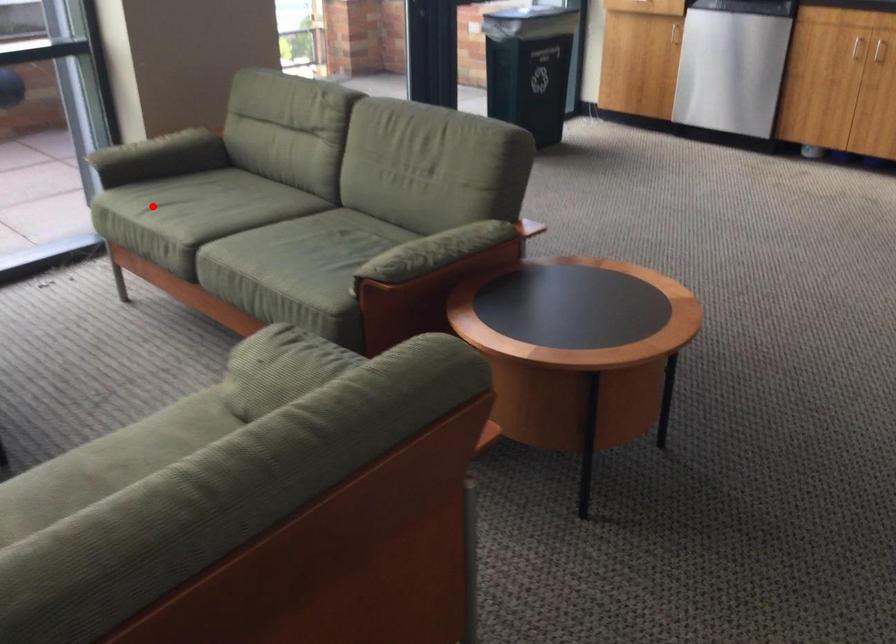
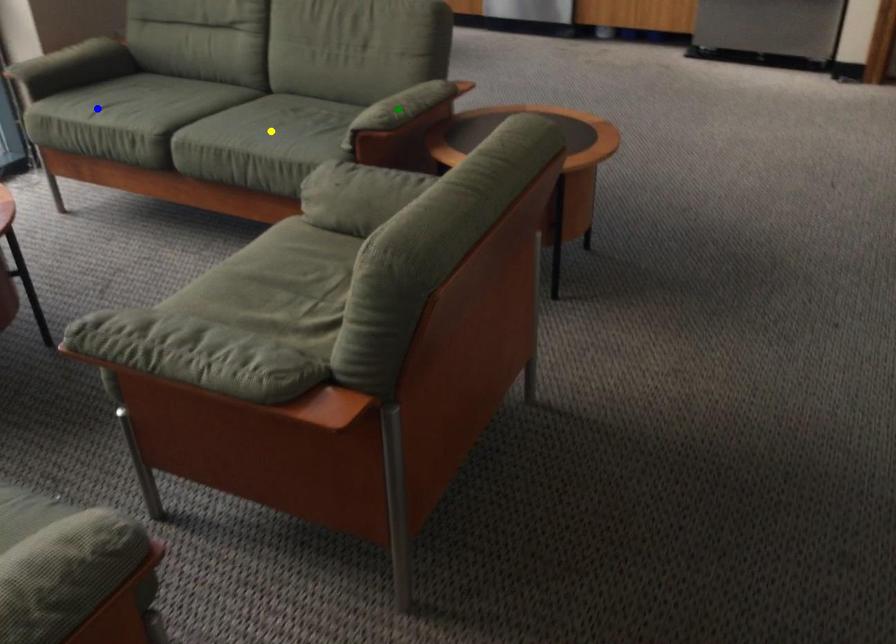
Question: I am providing you with two images of the same scene from different viewpoints. A red point is marked on the first image. You are given multiple points on the second image. In image 2, which mark is for the same physical point as the one in image 1?

Choices:
 (A) green point
 (B) blue point
 (C) yellow point

Answer: (B)